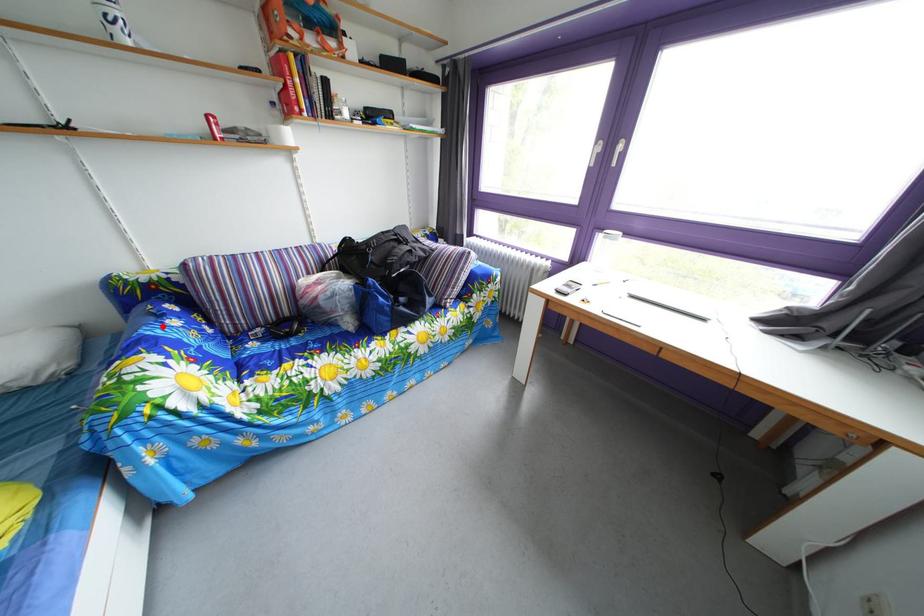
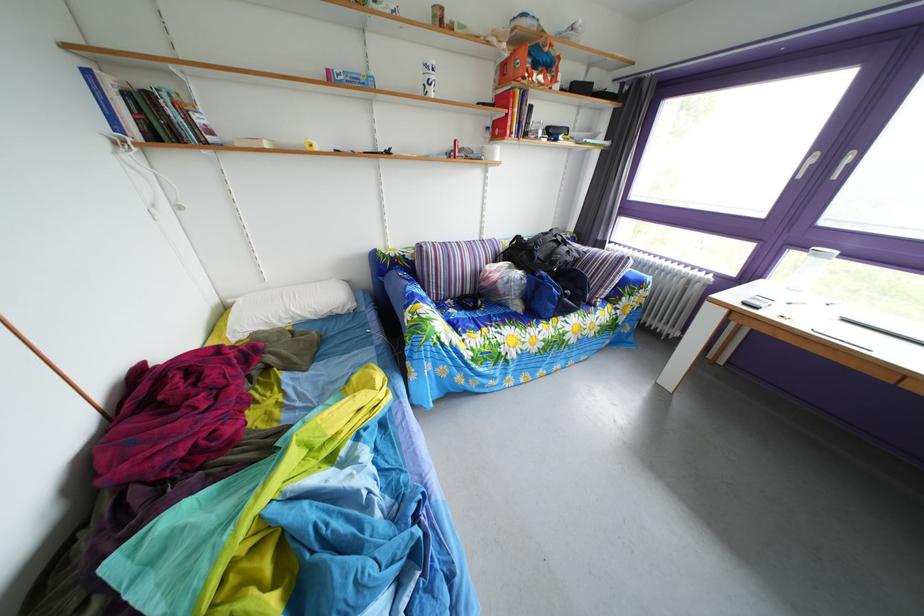
Locate, in the second image, the point that corresponds to the highlighted location in the first image.

(417, 290)